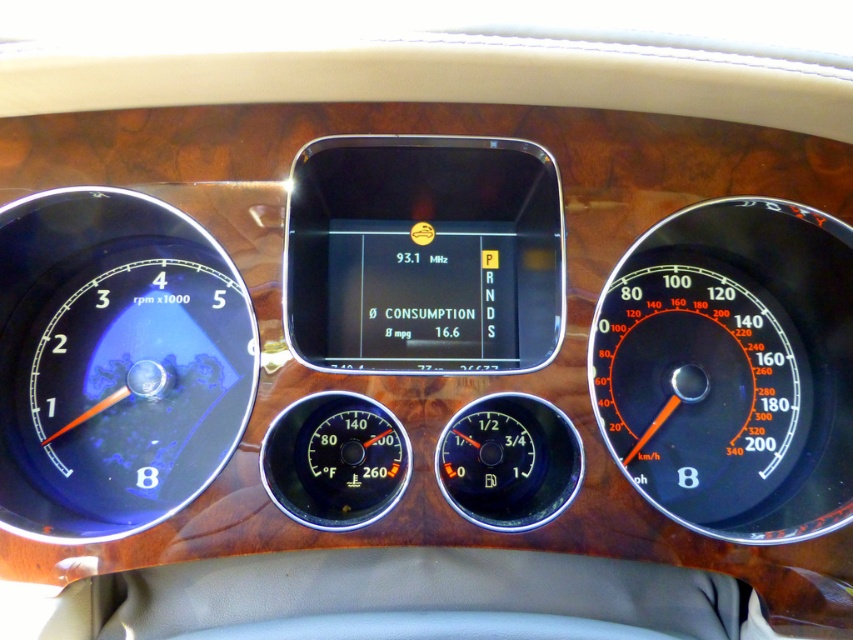
In the scene shown: You are a mechanic inspecting the dashboard of a car. You notice the black plastic speedometer at right and the black glass thermometer at center. Which object is taller?

The black plastic speedometer at right is taller than the black glass thermometer at center.

You are a driver checking the dashboard. You notice the matte black speedometer at left and the black glass thermometer at center. Which of these two objects is wider?

The matte black speedometer at left is wider than the black glass thermometer at center because its width surpasses the thermometer.